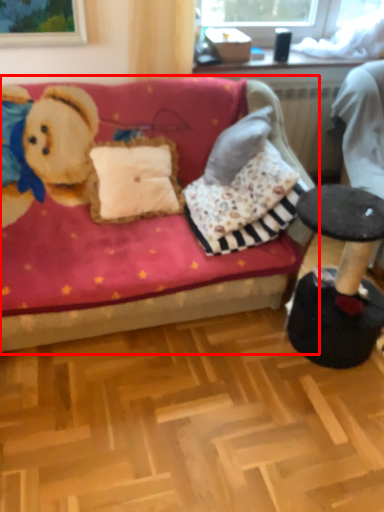
Question: From the image's perspective, considering the relative positions of studio couch (annotated by the red box) and swivel chair in the image provided, where is studio couch (annotated by the red box) located with respect to the staircase?

Choices:
 (A) above
 (B) below

Answer: (B)